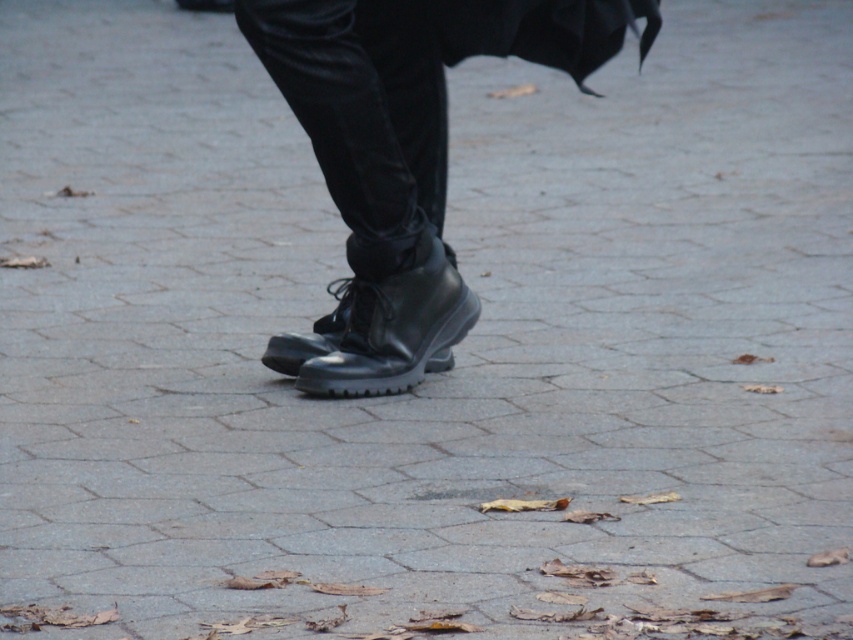
Can you confirm if shiny black boots at center is wider than black leather boot at center?

Indeed, shiny black boots at center has a greater width compared to black leather boot at center.

Does shiny black boots at center have a smaller size compared to black leather boot at center?

No, shiny black boots at center is not smaller than black leather boot at center.

Is point (421, 220) positioned in front of point (285, 349)?

Yes, point (421, 220) is in front of point (285, 349).

What are the coordinates of `shiny black boots at center` in the screenshot? It's located at (403, 156).